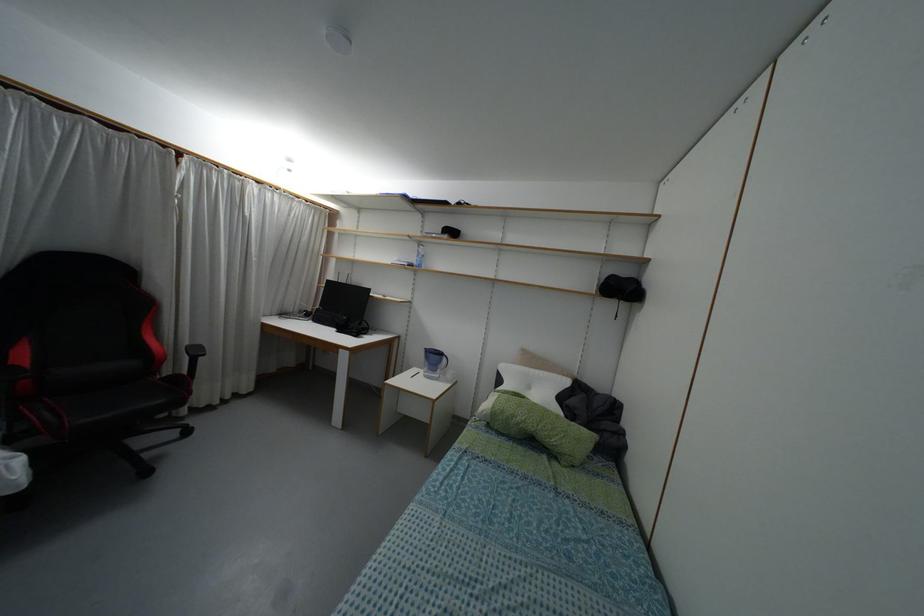
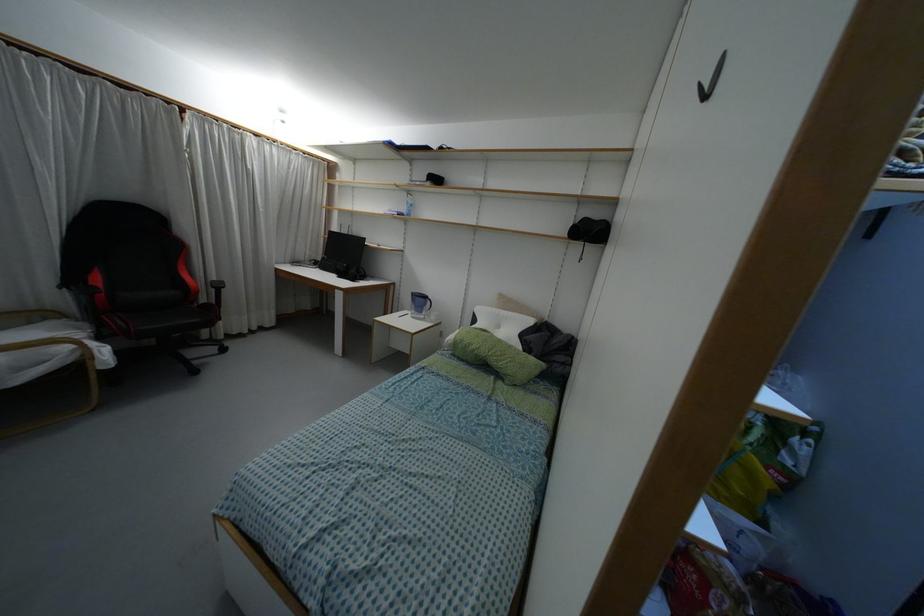
The point at (341, 329) is marked in the first image. Where is the corresponding point in the second image?

(341, 275)